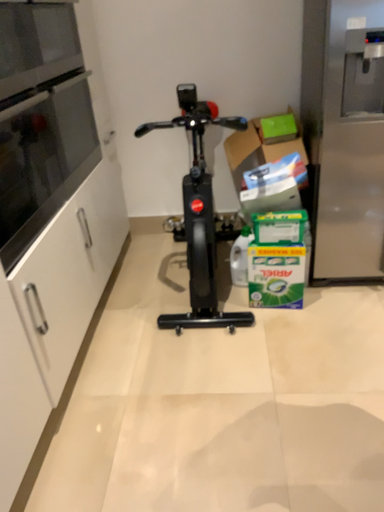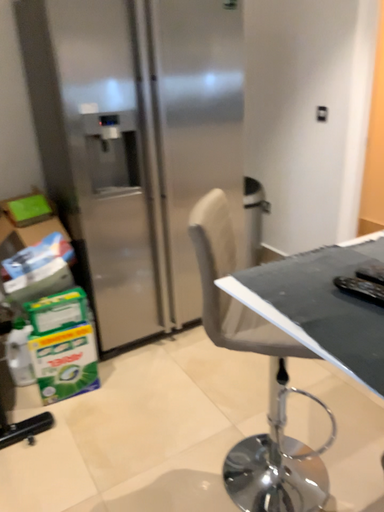
Question: How did the camera likely rotate when shooting the video?

Choices:
 (A) rotated upward
 (B) rotated downward

Answer: (A)